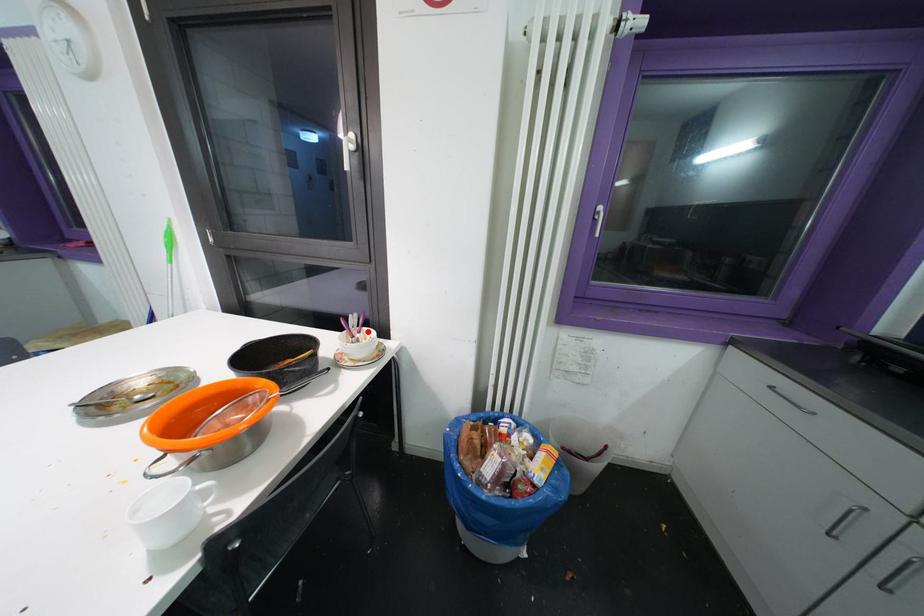
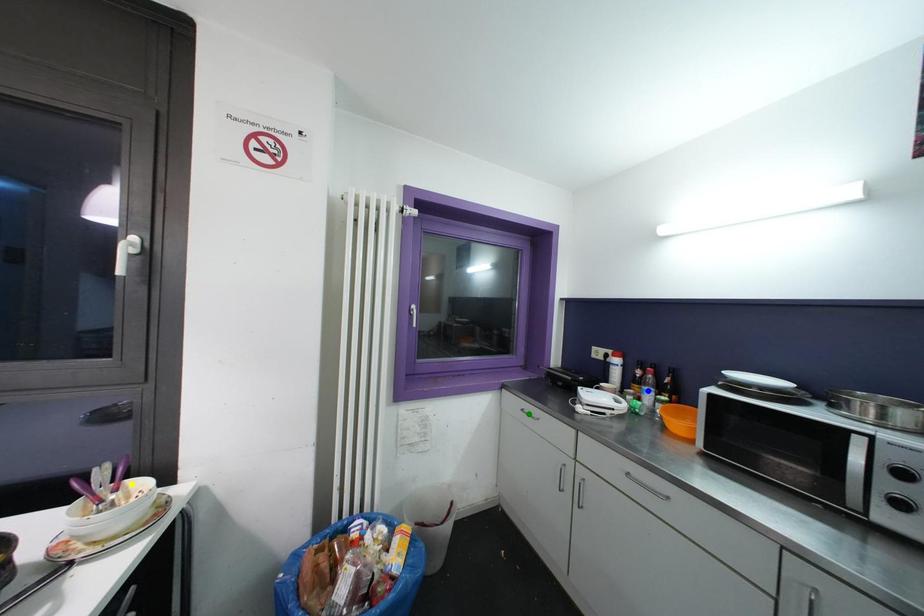
Question: I am providing you with two images of the same scene from different viewpoints. A red point is marked on the first image. You are given multiple points on the second image. Which point in image 2 represents the same 3d spot as the red point in image 1?

Choices:
 (A) blue point
 (B) yellow point
 (C) green point

Answer: (B)